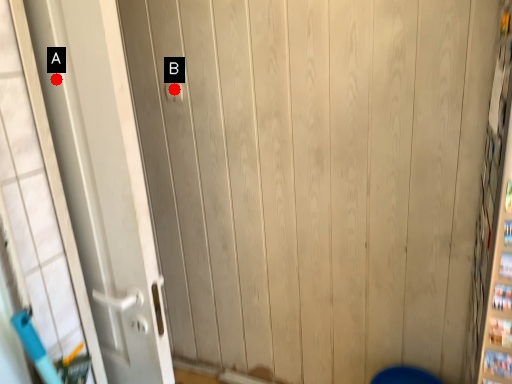
Question: Two points are circled on the image, labeled by A and B beside each circle. Which point is farther from the camera taking this photo?

Choices:
 (A) A is further
 (B) B is further

Answer: (B)